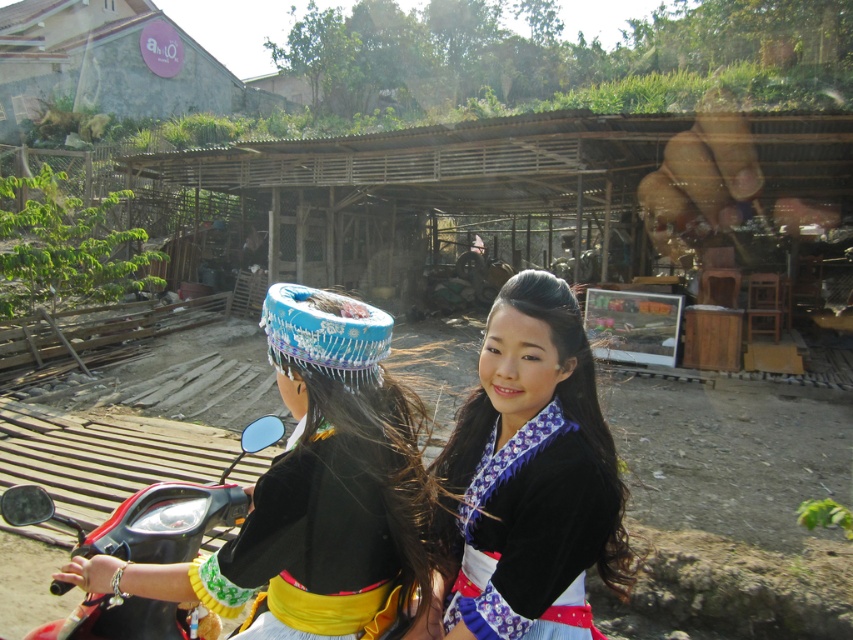
Describe the element at coordinates (318, 490) in the screenshot. The width and height of the screenshot is (853, 640). I see `matte black helmet at center` at that location.

Is matte black helmet at center to the right of shiny black motorcycle at center from the viewer's perspective?

Correct, you'll find matte black helmet at center to the right of shiny black motorcycle at center.

Does point (335, 332) lie behind point (94, 497)?

No, (335, 332) is closer to viewer.

The width and height of the screenshot is (853, 640). I want to click on matte black helmet at center, so click(318, 490).

Who is positioned more to the left, matte black kimono at center or shiny black motorcycle at center?

shiny black motorcycle at center is more to the left.

Which is more to the right, matte black kimono at center or shiny black motorcycle at center?

matte black kimono at center is more to the right.

From the picture: Measure the distance between point (502, 364) and camera.

The distance of point (502, 364) from camera is 1.34 meters.

This screenshot has height=640, width=853. In order to click on matte black kimono at center in this screenshot , I will do `click(532, 474)`.

How much distance is there between matte black helmet at center and matte black kimono at center?

matte black helmet at center and matte black kimono at center are 30.93 centimeters apart from each other.

Does matte black helmet at center have a lesser width compared to matte black kimono at center?

Incorrect, matte black helmet at center's width is not less than matte black kimono at center's.

Is point (421, 534) more distant than point (560, 340)?

Yes, it is.

You are a GUI agent. You are given a task and a screenshot of the screen. Output one action in this format:
    pyautogui.click(x=<x>, y=<y>)
    Task: Click on the matte black helmet at center
    
    Given the screenshot: What is the action you would take?
    pyautogui.click(x=318, y=490)